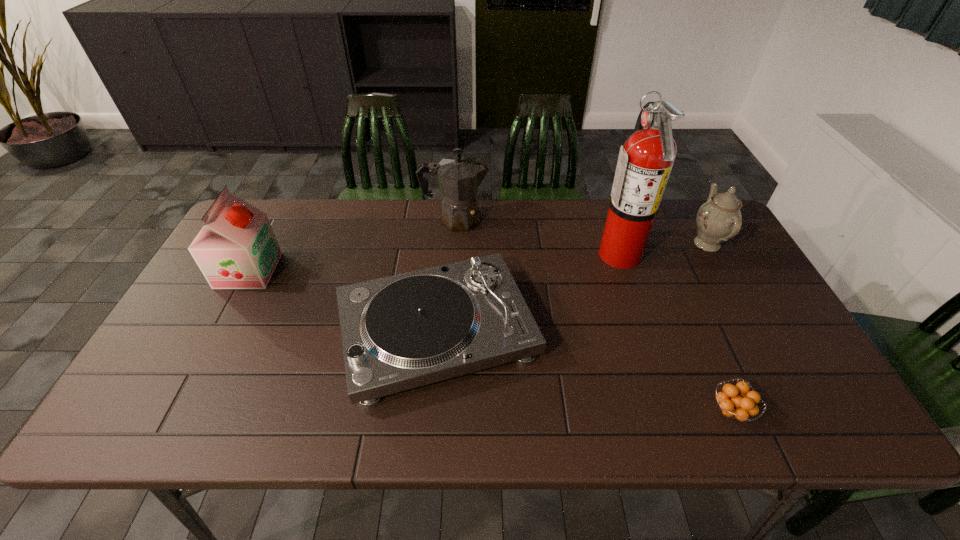
You are a GUI agent. You are given a task and a screenshot of the screen. Output one action in this format:
    pyautogui.click(x=<x>, y=<y>)
    Task: Click on the fire extinguisher
    
    Given the screenshot: What is the action you would take?
    pyautogui.click(x=644, y=165)

Find the location of `the tallest object`. the tallest object is located at coordinates (644, 165).

Where is `coffeepot`? This screenshot has width=960, height=540. coffeepot is located at coordinates (459, 177).

Identify the location of soya milk. This screenshot has height=540, width=960. (236, 249).

Locate an element on the screen. chinaware is located at coordinates (719, 219).

The height and width of the screenshot is (540, 960). Identify the location of the fourth tallest object. (719, 219).

Where is `the fifth tallest object`? the fifth tallest object is located at coordinates (403, 331).

Find the location of `the second object from right to left`. the second object from right to left is located at coordinates (734, 402).

This screenshot has width=960, height=540. I want to click on the shortest object, so click(x=734, y=402).

Find the location of a particular element. vacant space located on the nozzle side of the fourth object from left to right is located at coordinates (545, 253).